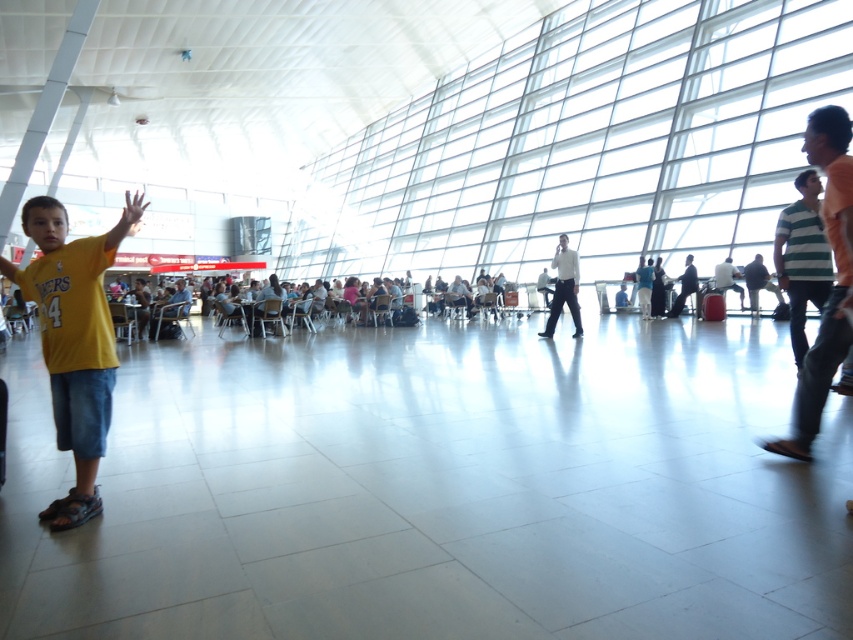
You are navigating through the airport terminal and need to reach a specific location. You notice two points marked on the floor at coordinates point [96,403] and point [572,262]. If you are facing the direction of the large glass windows, which point is closer to you?

Point [96,403] is in front of point [572,262] when facing the large glass windows, so the point [96,403] is closer to you.

You are a photographer planning to take a group photo of the white smooth shirt at center and dark gray suit at center in the airport terminal. Considering their clothing widths, which person should you position closer to the camera to ensure their outfit appears proportionally sized in the photo?

The white smooth shirt at center has a greater width than the dark gray suit at center. To maintain proportional sizing in the photo, position the dark gray suit at center closer to the camera so that its smaller width appears larger, balancing it with the wider white smooth shirt at center.